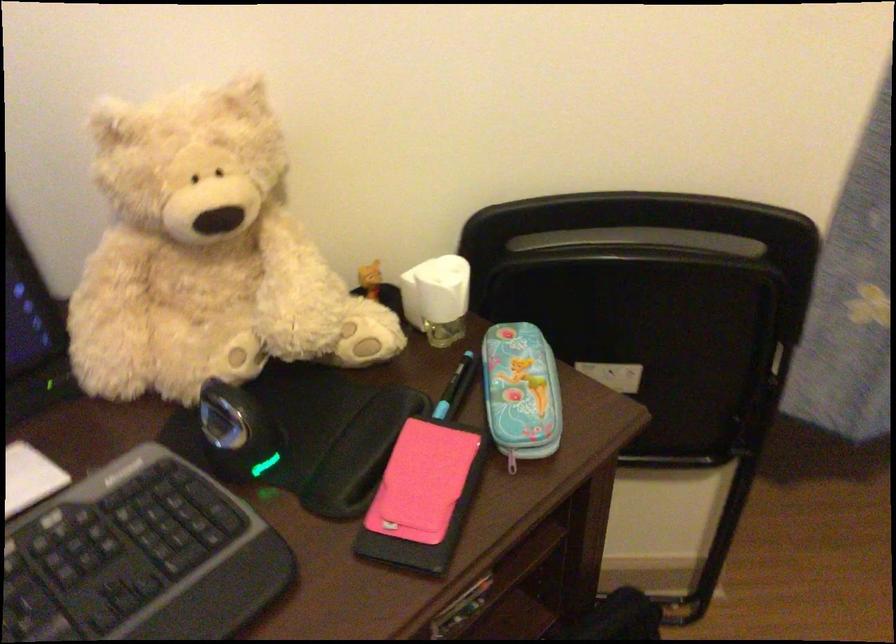
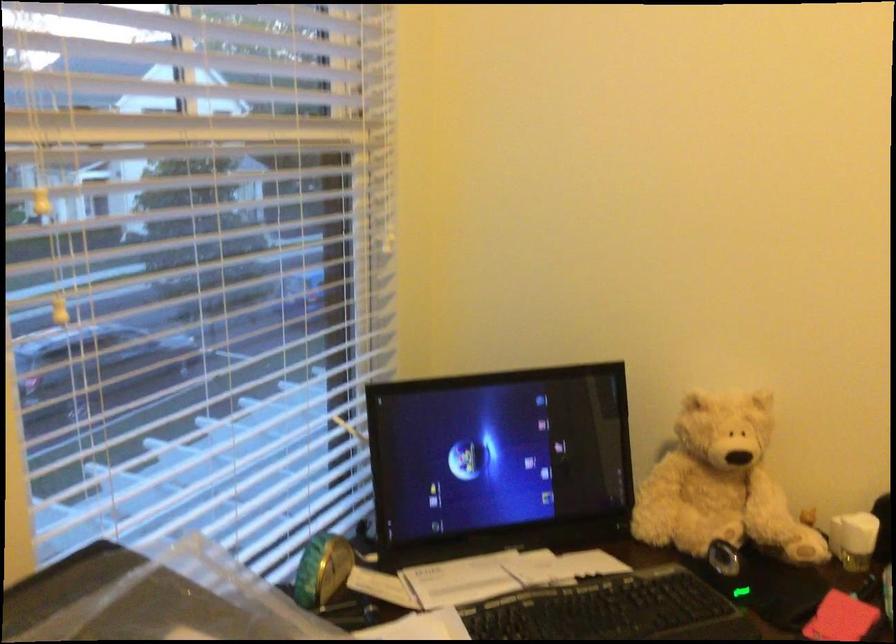
In the second image, find the point that corresponds to (227,274) in the first image.

(720, 484)